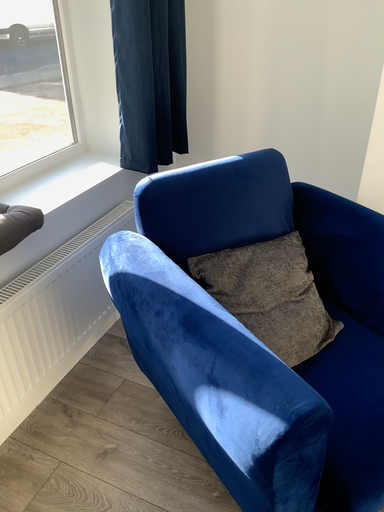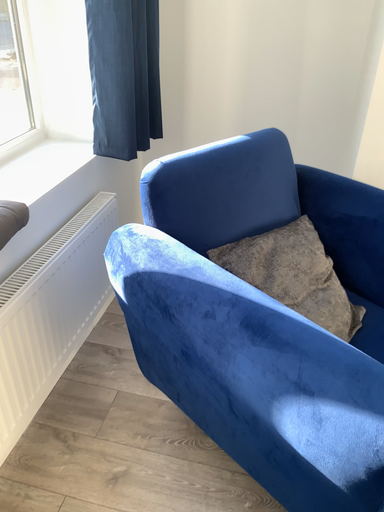
Question: How did the camera likely rotate when shooting the video?

Choices:
 (A) rotated left
 (B) rotated right

Answer: (B)